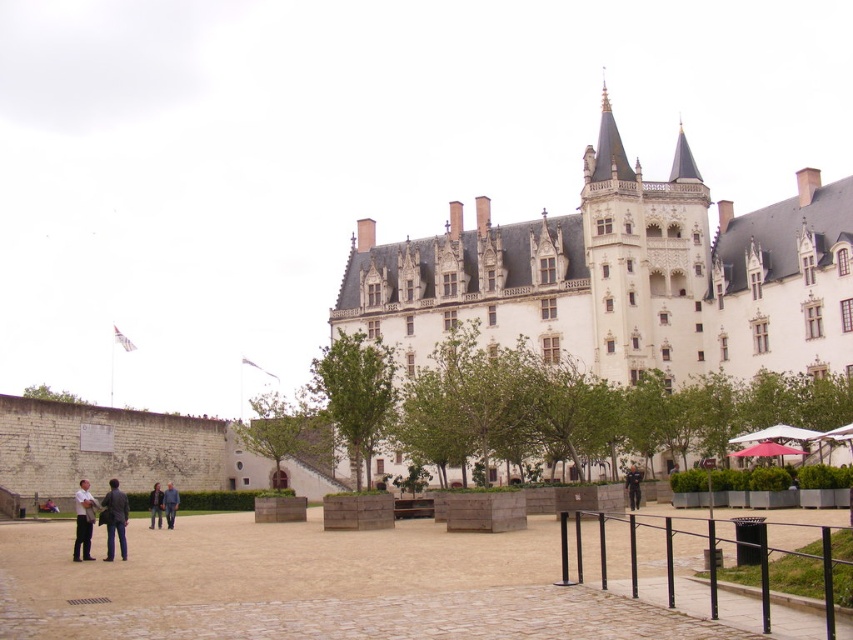
Which of these two, white stone castle at center or dark blue jeans at center, stands taller?

white stone castle at center is taller.

Describe the element at coordinates (624, 276) in the screenshot. I see `white stone castle at center` at that location.

Where is `white stone castle at center`? This screenshot has height=640, width=853. white stone castle at center is located at coordinates (624, 276).

Which is below, brown stone plaza at center or dark gray jacket at lower left?

brown stone plaza at center is below.

The width and height of the screenshot is (853, 640). I want to click on brown stone plaza at center, so click(x=334, y=586).

I want to click on brown stone plaza at center, so click(334, 586).

Which is above, black fabric person at center or dark blue jeans at center?

black fabric person at center

Between point (631, 472) and point (170, 516), which one is positioned behind?

The point (170, 516) is behind.

Who is more distant from viewer, (630, 490) or (173, 497)?

The point (173, 497) is behind.

The height and width of the screenshot is (640, 853). I want to click on black fabric person at center, so click(x=633, y=486).